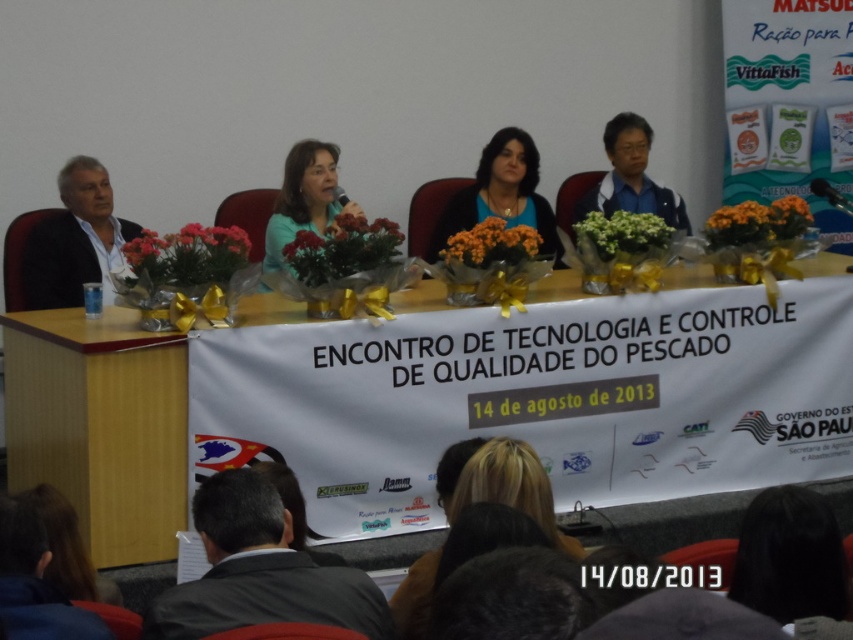
Based on the photo, is the position of wooden table at center more distant than that of blonde hair at center?

Yes, it is.

Who is shorter, wooden table at center or blonde hair at center?

blonde hair at center

Describe the element at coordinates (100, 426) in the screenshot. I see `wooden table at center` at that location.

Locate an element on the screen. wooden table at center is located at coordinates (100, 426).

Where is `wooden table at center`? wooden table at center is located at coordinates (100, 426).

Between wooden table at center and matte green shirt at center, which one appears on the left side from the viewer's perspective?

wooden table at center

Image resolution: width=853 pixels, height=640 pixels. What do you see at coordinates (100, 426) in the screenshot?
I see `wooden table at center` at bounding box center [100, 426].

Identify the location of wooden table at center. (100, 426).

Is blonde hair at center bigger than blue matte shirt at center?

Yes.

Is blonde hair at center taller than blue matte shirt at center?

Incorrect, blonde hair at center's height is not larger of blue matte shirt at center's.

Where is `blonde hair at center`? The width and height of the screenshot is (853, 640). blonde hair at center is located at coordinates (500, 483).